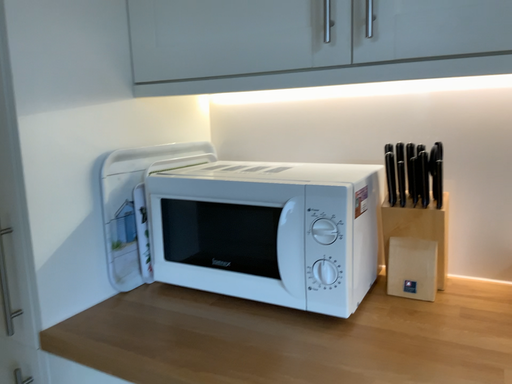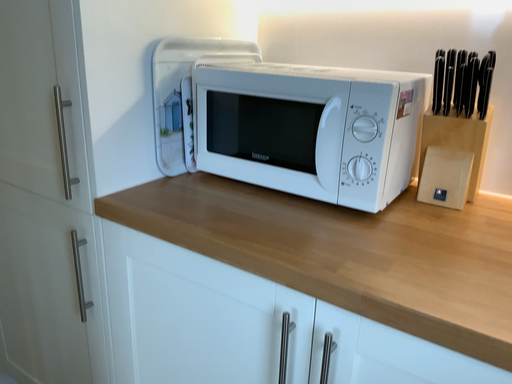
Question: Which way did the camera rotate in the video?

Choices:
 (A) rotated downward
 (B) rotated upward

Answer: (A)